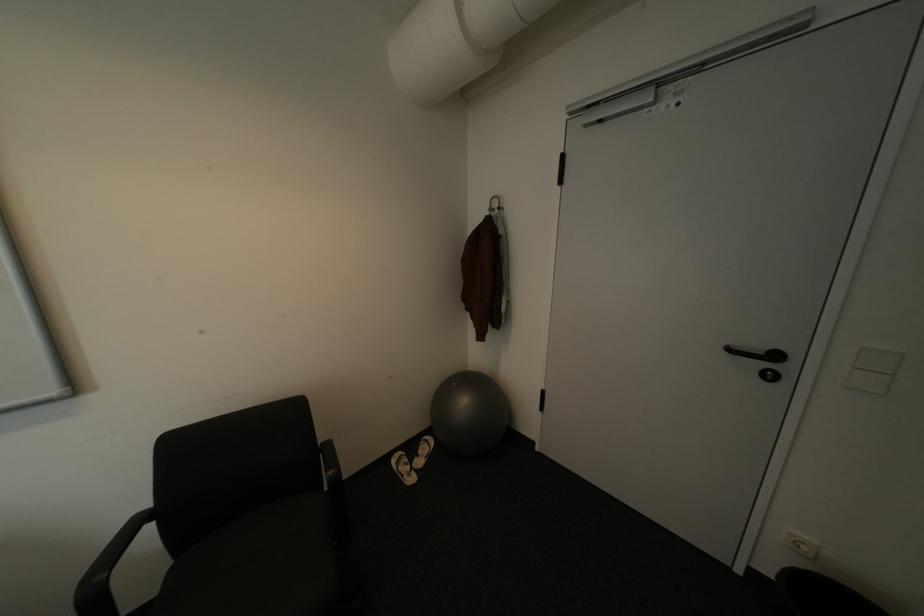
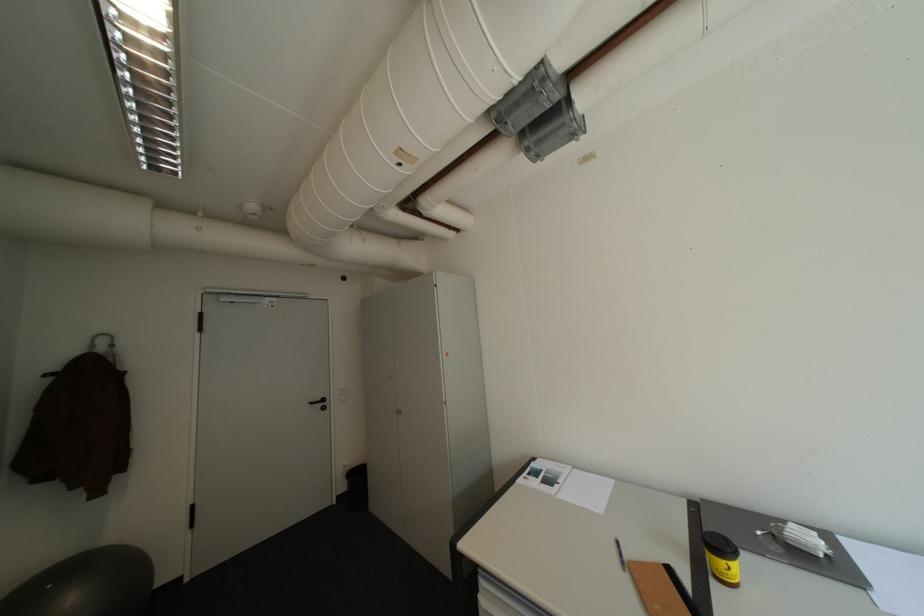
Find the pixel in the second image that matches (739,350) in the first image.

(321, 403)